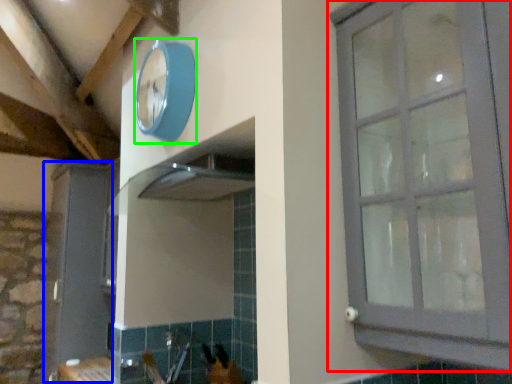
Question: Which object is the farthest from window (highlighted by a red box)? Choose among these: screen door (highlighted by a blue box) or clock (highlighted by a green box).

Choices:
 (A) screen door
 (B) clock

Answer: (A)